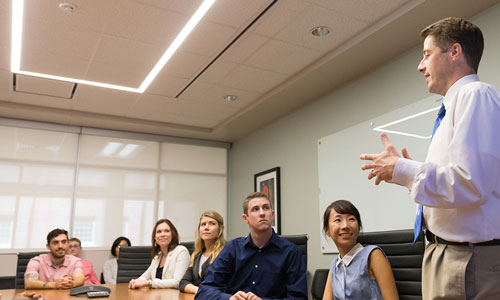
The height and width of the screenshot is (300, 500). Identify the location of chairs. (19, 253), (131, 257), (189, 244), (301, 239), (399, 252), (102, 279).